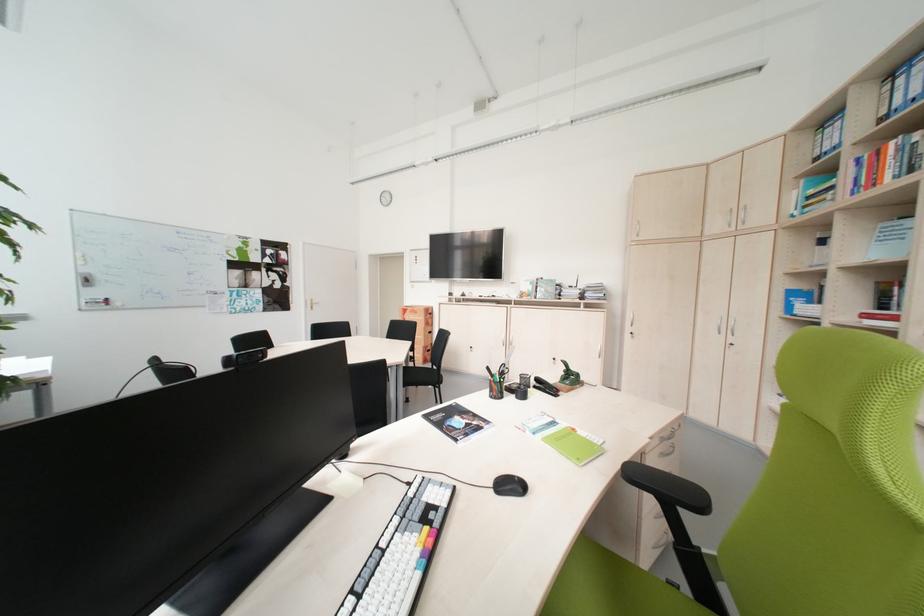
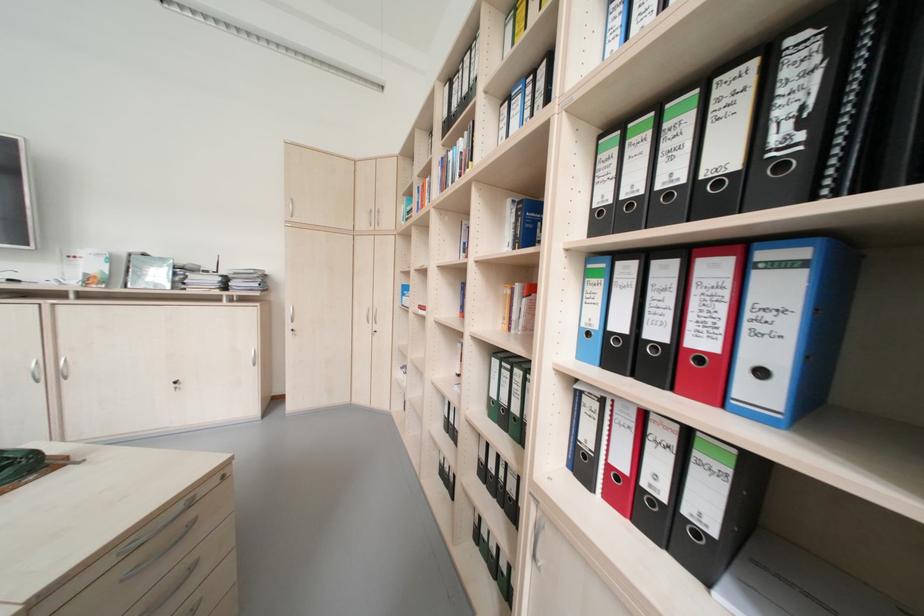
Question: The first image is from the beginning of the video and the second image is from the end. How did the camera likely rotate when shooting the video?

Choices:
 (A) Left
 (B) Right
 (C) Up
 (D) Down

Answer: (B)